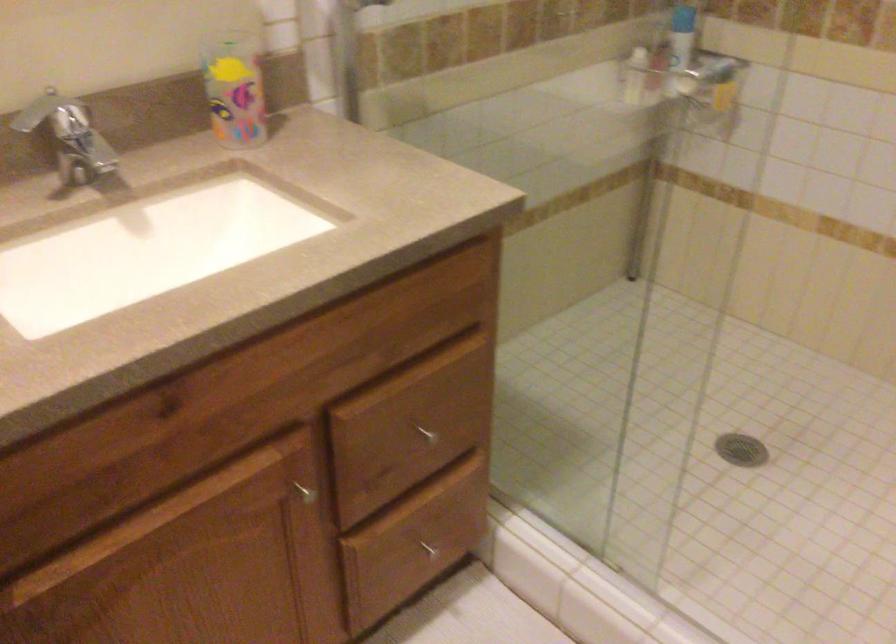
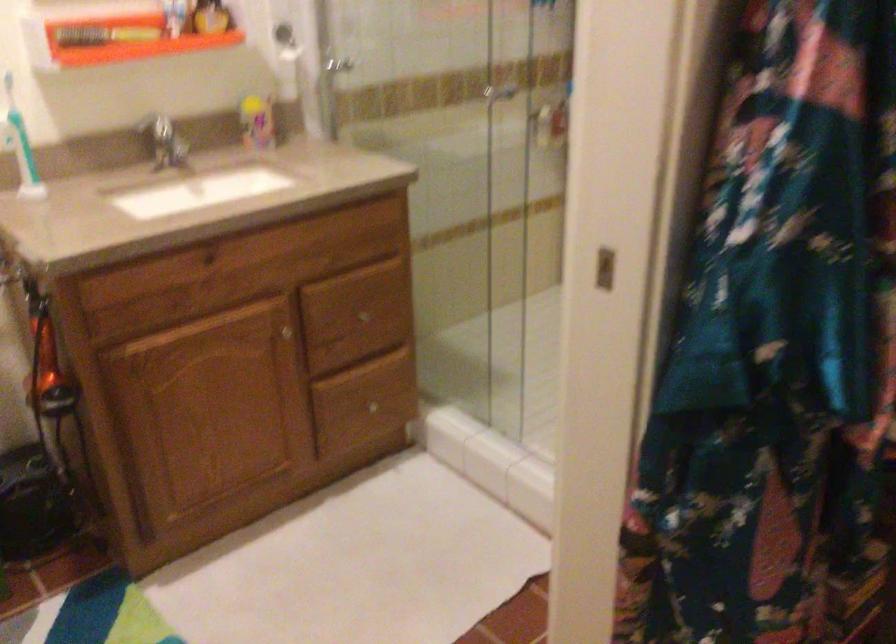
Question: How did the camera likely rotate?

Choices:
 (A) Left
 (B) Right
 (C) Up
 (D) Down

Answer: (C)